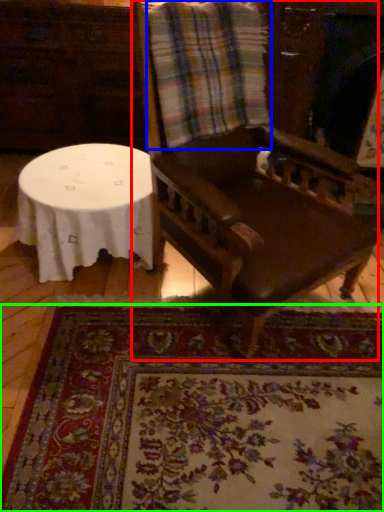
Question: Which object is positioned closest to chair (highlighted by a red box)? Select from flannel (highlighted by a blue box) and mat (highlighted by a green box).

Choices:
 (A) flannel
 (B) mat

Answer: (A)